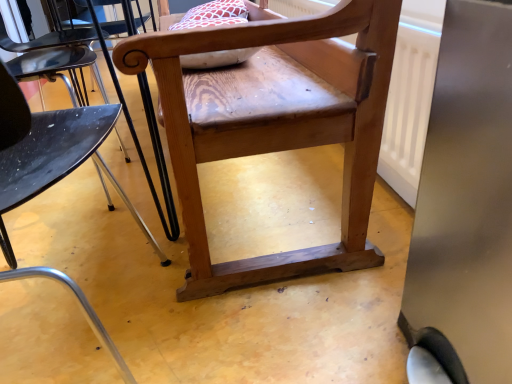
The width and height of the screenshot is (512, 384). What do you see at coordinates (52, 174) in the screenshot?
I see `wooden chair at center, arranged as the 1th chair when viewed from the front` at bounding box center [52, 174].

Identify the location of wooden chair at center, which appears as the 2th chair when viewed from the back. (52, 174).

Locate an element on the screen. natural wood chair at center, the 1th chair viewed from the back is located at coordinates (275, 121).

What do you see at coordinates (275, 121) in the screenshot? The image size is (512, 384). I see `natural wood chair at center, arranged as the second chair when viewed from the front` at bounding box center [275, 121].

Where is `wooden chair at center, arranged as the 1th chair when viewed from the front`? This screenshot has width=512, height=384. wooden chair at center, arranged as the 1th chair when viewed from the front is located at coordinates (52, 174).

Can you confirm if wooden chair at center, arranged as the 1th chair when viewed from the front, is positioned to the right of natural wood chair at center, arranged as the second chair when viewed from the front?

No, wooden chair at center, arranged as the 1th chair when viewed from the front, is not to the right of natural wood chair at center, arranged as the second chair when viewed from the front.

Considering the positions of objects wooden chair at center, arranged as the 1th chair when viewed from the front, and natural wood chair at center, the 1th chair viewed from the back, in the image provided, who is in front, wooden chair at center, arranged as the 1th chair when viewed from the front, or natural wood chair at center, the 1th chair viewed from the back,?

wooden chair at center, arranged as the 1th chair when viewed from the front, is closer to the camera.

Which is further, (51, 146) or (313, 93)?

The point (313, 93) is farther from the camera.

From the image's perspective, is wooden chair at center, arranged as the 1th chair when viewed from the front, above or below natural wood chair at center, arranged as the second chair when viewed from the front?

Based on their image positions, wooden chair at center, arranged as the 1th chair when viewed from the front, is located beneath natural wood chair at center, arranged as the second chair when viewed from the front.

From a real-world perspective, is wooden chair at center, arranged as the 1th chair when viewed from the front, physically above natural wood chair at center, arranged as the second chair when viewed from the front?

Yes, from a real-world perspective, wooden chair at center, arranged as the 1th chair when viewed from the front, is above natural wood chair at center, arranged as the second chair when viewed from the front.

Which of these two, wooden chair at center, which appears as the 2th chair when viewed from the back, or natural wood chair at center, the 1th chair viewed from the back, is thinner?

wooden chair at center, which appears as the 2th chair when viewed from the back, is thinner.

Consider the image. Is wooden chair at center, which appears as the 2th chair when viewed from the back, taller or shorter than natural wood chair at center, arranged as the second chair when viewed from the front?

Considering their sizes, wooden chair at center, which appears as the 2th chair when viewed from the back, has more height than natural wood chair at center, arranged as the second chair when viewed from the front.

Between wooden chair at center, which appears as the 2th chair when viewed from the back, and natural wood chair at center, arranged as the second chair when viewed from the front, which one has larger size?

natural wood chair at center, arranged as the second chair when viewed from the front.

Could natural wood chair at center, arranged as the second chair when viewed from the front, be considered to be inside wooden chair at center, which appears as the 2th chair when viewed from the back?

No, natural wood chair at center, arranged as the second chair when viewed from the front, is not surrounded by wooden chair at center, which appears as the 2th chair when viewed from the back.

Is wooden chair at center, arranged as the 1th chair when viewed from the front, not close to natural wood chair at center, the 1th chair viewed from the back?

No, wooden chair at center, arranged as the 1th chair when viewed from the front, is not far away from natural wood chair at center, the 1th chair viewed from the back.

Is wooden chair at center, which appears as the 2th chair when viewed from the back, oriented away from natural wood chair at center, the 1th chair viewed from the back?

No, wooden chair at center, which appears as the 2th chair when viewed from the back, is not facing the opposite direction of natural wood chair at center, the 1th chair viewed from the back.

How different are the orientations of wooden chair at center, which appears as the 2th chair when viewed from the back, and natural wood chair at center, the 1th chair viewed from the back, in degrees?

They differ by 90.7 degrees in their facing directions.

Locate an element on the screen. chair below the natural wood chair at center, the 1th chair viewed from the back (from the image's perspective) is located at coordinates (52, 174).

Does natural wood chair at center, arranged as the second chair when viewed from the front, appear on the right side of wooden chair at center, arranged as the 1th chair when viewed from the front?

Yes, natural wood chair at center, arranged as the second chair when viewed from the front, is to the right of wooden chair at center, arranged as the 1th chair when viewed from the front.

Relative to wooden chair at center, which appears as the 2th chair when viewed from the back, is natural wood chair at center, the 1th chair viewed from the back, in front or behind?

In the image, natural wood chair at center, the 1th chair viewed from the back, appears behind wooden chair at center, which appears as the 2th chair when viewed from the back.

Considering the points (349, 207) and (55, 128), which point is behind, point (349, 207) or point (55, 128)?

The point (349, 207) is farther from the camera.

From the image's perspective, is natural wood chair at center, the 1th chair viewed from the back, located above or below wooden chair at center, which appears as the 2th chair when viewed from the back?

Based on their image positions, natural wood chair at center, the 1th chair viewed from the back, is located above wooden chair at center, which appears as the 2th chair when viewed from the back.

From a real-world perspective, is natural wood chair at center, the 1th chair viewed from the back, on wooden chair at center, which appears as the 2th chair when viewed from the back?

Actually, natural wood chair at center, the 1th chair viewed from the back, is physically below wooden chair at center, which appears as the 2th chair when viewed from the back, in the real world.

Which of these two, natural wood chair at center, arranged as the second chair when viewed from the front, or wooden chair at center, arranged as the 1th chair when viewed from the front, is thinner?

With smaller width is wooden chair at center, arranged as the 1th chair when viewed from the front.

Who is shorter, natural wood chair at center, the 1th chair viewed from the back, or wooden chair at center, which appears as the 2th chair when viewed from the back?

natural wood chair at center, the 1th chair viewed from the back.

Is natural wood chair at center, arranged as the second chair when viewed from the front, bigger than wooden chair at center, which appears as the 2th chair when viewed from the back?

Yes, natural wood chair at center, arranged as the second chair when viewed from the front, is bigger than wooden chair at center, which appears as the 2th chair when viewed from the back.

Is natural wood chair at center, arranged as the second chair when viewed from the front, positioned beyond the bounds of wooden chair at center, arranged as the 1th chair when viewed from the front?

Yes, natural wood chair at center, arranged as the second chair when viewed from the front, is outside of wooden chair at center, arranged as the 1th chair when viewed from the front.

Is natural wood chair at center, arranged as the second chair when viewed from the front, not close to wooden chair at center, which appears as the 2th chair when viewed from the back?

They are positioned close to each other.

Is natural wood chair at center, the 1th chair viewed from the back, positioned with its back to wooden chair at center, arranged as the 1th chair when viewed from the front?

No, natural wood chair at center, the 1th chair viewed from the back, is not facing the opposite direction of wooden chair at center, arranged as the 1th chair when viewed from the front.

Measure the distance between natural wood chair at center, the 1th chair viewed from the back, and wooden chair at center, arranged as the 1th chair when viewed from the front.

A distance of 32.58 centimeters exists between natural wood chair at center, the 1th chair viewed from the back, and wooden chair at center, arranged as the 1th chair when viewed from the front.

There is a natural wood chair at center, the 1th chair viewed from the back. Where is `chair above it (from a real-world perspective)`? Image resolution: width=512 pixels, height=384 pixels. chair above it (from a real-world perspective) is located at coordinates (52, 174).

Identify the location of chair below the wooden chair at center, which appears as the 2th chair when viewed from the back (from a real-world perspective). (275, 121).

You are a GUI agent. You are given a task and a screenshot of the screen. Output one action in this format:
    pyautogui.click(x=<x>, y=<y>)
    Task: Click on the chair to the right of wooden chair at center, arranged as the 1th chair when viewed from the front
    Image resolution: width=512 pixels, height=384 pixels.
    Given the screenshot: What is the action you would take?
    pyautogui.click(x=275, y=121)